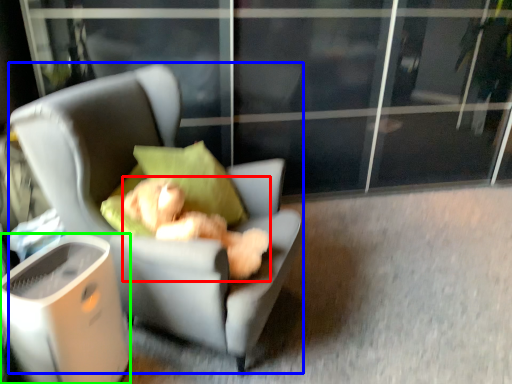
Question: Which object is positioned farthest from teddy bear (highlighted by a red box)? Select from chair (highlighted by a blue box) and trash bin/can (highlighted by a green box).

Choices:
 (A) chair
 (B) trash bin/can

Answer: (B)